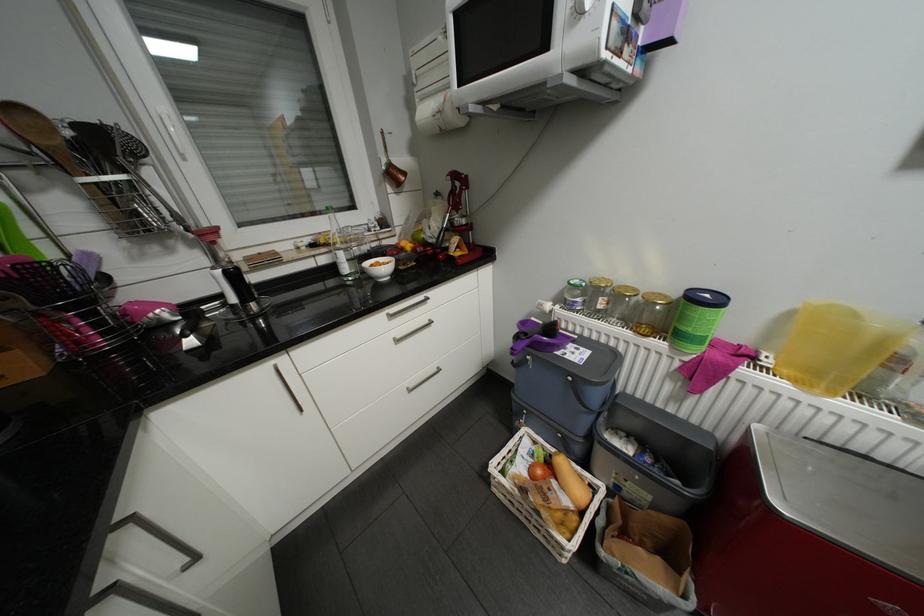
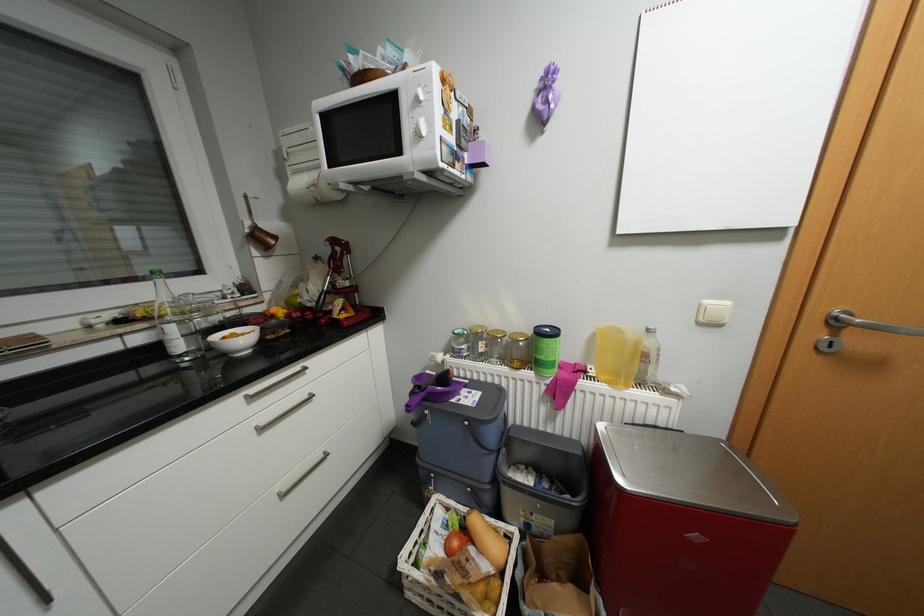
Locate, in the second image, the point that corresponds to point (775, 361) in the first image.

(600, 371)